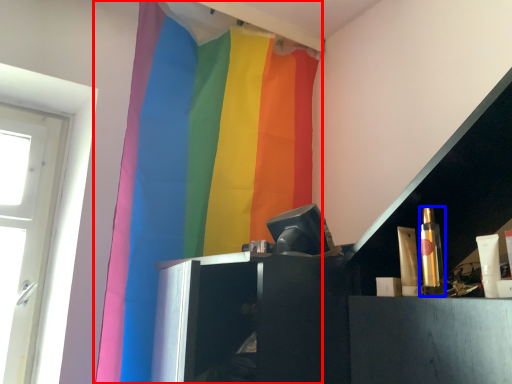
Question: Which point is further to the camera, curtain (highlighted by a red box) or toiletry (highlighted by a blue box)?

Choices:
 (A) curtain
 (B) toiletry

Answer: (A)